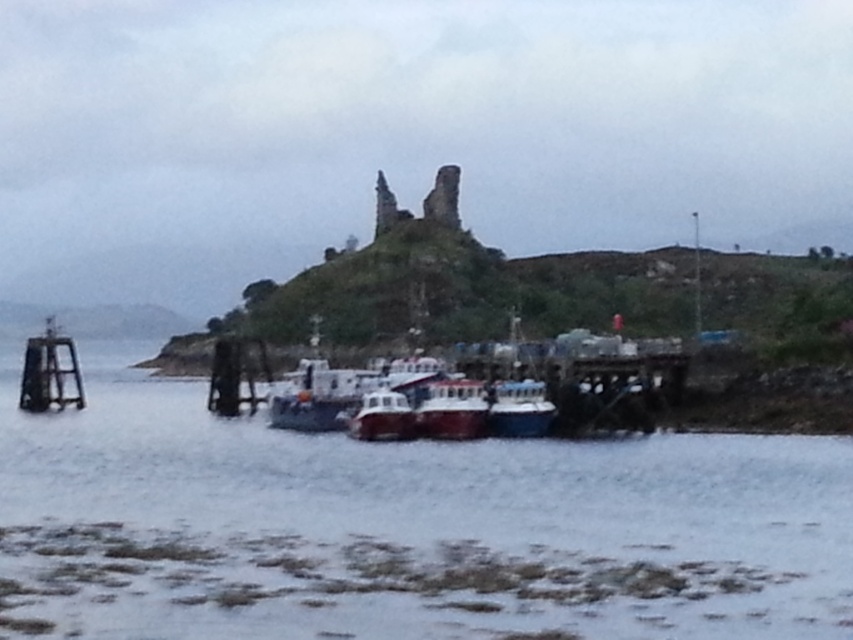
Which is more to the left, red glossy boat at center or blue glossy boat at center?

red glossy boat at center

Does point (467, 432) come closer to viewer compared to point (515, 422)?

Yes, it is.

Identify the location of red glossy boat at center. This screenshot has width=853, height=640. (451, 410).

Which is above, white matte boat at center or blue glossy boat at center?

white matte boat at center is above.

Does white matte boat at center lie behind blue glossy boat at center?

Yes, white matte boat at center is behind blue glossy boat at center.

Describe the element at coordinates (312, 396) in the screenshot. The width and height of the screenshot is (853, 640). I see `white matte boat at center` at that location.

Identify the location of white matte boat at center. The height and width of the screenshot is (640, 853). (312, 396).

Looking at this image, is white matte boat at center in front of red glossy boat at center?

No, it is behind red glossy boat at center.

Is point (288, 401) in front of point (451, 394)?

No, it is not.

What are the coordinates of `white matte boat at center` in the screenshot? It's located at (312, 396).